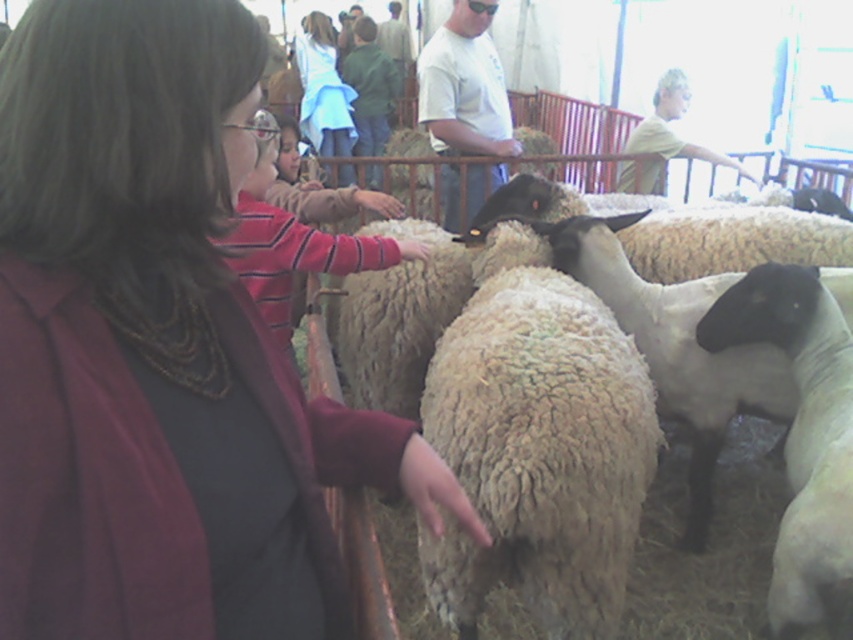
Does white woolen sheep at center have a lesser width compared to white t-shirt at center?

No, white woolen sheep at center is not thinner than white t-shirt at center.

Measure the distance between white woolen sheep at center and camera.

The distance of white woolen sheep at center from camera is 2.58 meters.

Is point (337, 280) more distant than point (503, 131)?

That is False.

Where is `white woolen sheep at center`? white woolen sheep at center is located at coordinates (393, 317).

Looking at this image, between white t-shirt at center and light blue denim jacket at upper center, which one appears on the left side from the viewer's perspective?

light blue denim jacket at upper center

Is point (474, 92) behind point (320, 99)?

No, it is in front of (320, 99).

Find the location of a particular element. The width and height of the screenshot is (853, 640). white t-shirt at center is located at coordinates (463, 84).

At what (x,y) coordinates should I click in order to perform the action: click on white t-shirt at center. Please return your answer as a coordinate pair (x, y). Looking at the image, I should click on (463, 84).

Describe the element at coordinates (158, 349) in the screenshot. I see `dark brown hair at center` at that location.

Is dark brown hair at center closer to camera compared to white t-shirt at center?

Yes, it is.

Which is in front, point (32, 285) or point (448, 42)?

Point (32, 285) is more forward.

Identify the location of dark brown hair at center. (158, 349).